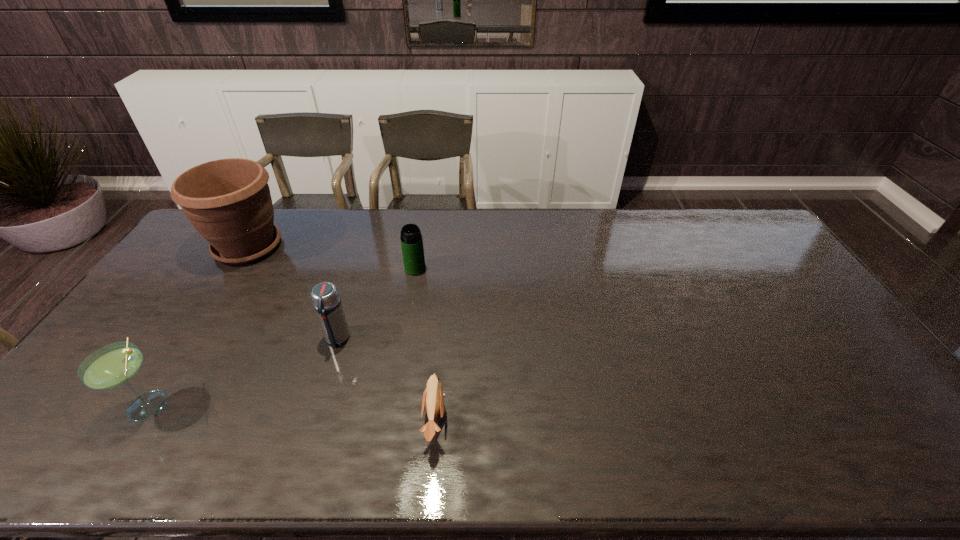
Image resolution: width=960 pixels, height=540 pixels. What are the coordinates of `vacant region at the left edge of the desktop` in the screenshot? It's located at (116, 339).

The image size is (960, 540). In order to click on vacant space at the right edge of the desktop in this screenshot , I will do `click(750, 262)`.

Identify the location of free location at the far left corner of the desktop. (193, 246).

Where is `empty space that is in between the tallest object and the farther thermos bottle`? Image resolution: width=960 pixels, height=540 pixels. empty space that is in between the tallest object and the farther thermos bottle is located at coordinates coord(331,258).

Where is `empty location between the martini and the fourth object from left to right`? The height and width of the screenshot is (540, 960). empty location between the martini and the fourth object from left to right is located at coordinates (282, 336).

I want to click on vacant region between the flowerpot and the left thermos bottle, so point(293,293).

Locate an element on the screen. Image resolution: width=960 pixels, height=540 pixels. vacant space that is in between the martini and the bird is located at coordinates (292, 412).

Locate an element on the screen. Image resolution: width=960 pixels, height=540 pixels. free space between the nearer thermos bottle and the martini is located at coordinates (243, 372).

Locate an element on the screen. Image resolution: width=960 pixels, height=540 pixels. free space between the left thermos bottle and the farther thermos bottle is located at coordinates (376, 303).

Locate an element on the screen. This screenshot has width=960, height=540. free space between the shortest object and the third object from left to right is located at coordinates (386, 379).